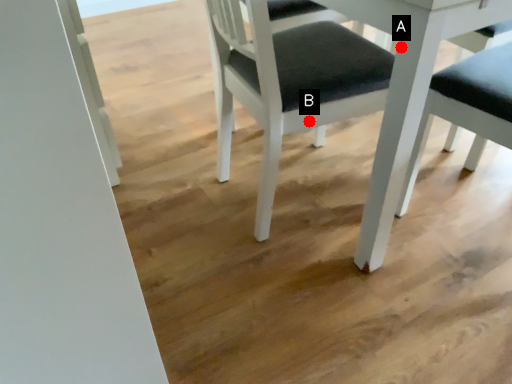
Question: Two points are circled on the image, labeled by A and B beside each circle. Among these points, which one is nearest to the camera?

Choices:
 (A) A is closer
 (B) B is closer

Answer: (A)